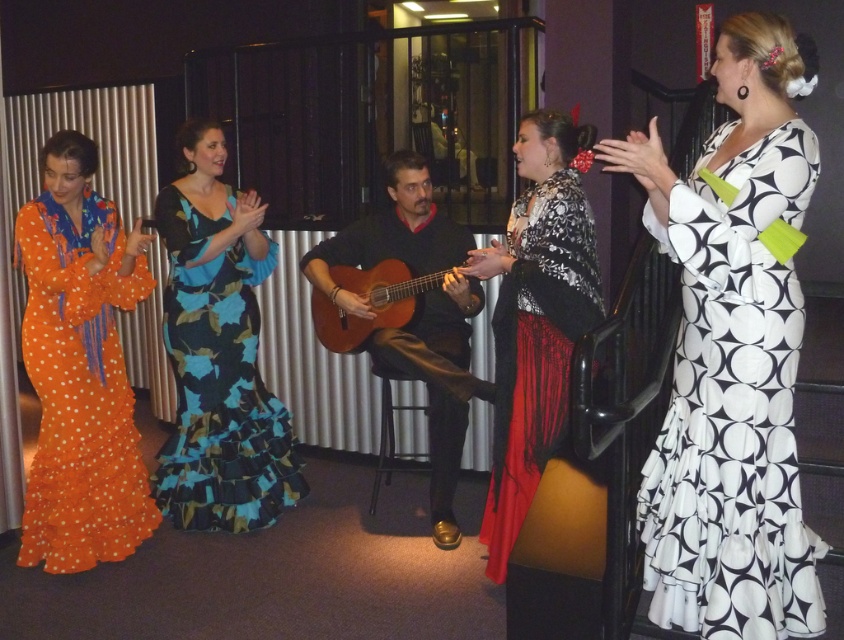
You are a photographer setting up for a flamenco performance. You have two dresses in your viewfinder, the black and white printed dress at right and the black lace dress at center. Which dress appears smaller in your photo?

The black and white printed dress at right appears smaller than the black lace dress at center in the photo.

You are a photographer at the flamenco performance. You need to capture a photo where the black and white printed dress at right and the black lace dress at center are both visible. Which dress will appear shorter in the photo?

The black and white printed dress at right is shorter than the black lace dress at center, so it will appear shorter in the photo.

You are a photographer positioned at the front of the stage. You want to capture a photo where both the matte black guitar at center and the wooden acoustic guitar at center are visible. Which guitar should you adjust your camera angle to focus on first to ensure both are in frame?

The matte black guitar at center is to the right of the wooden acoustic guitar at center. To ensure both are in frame, focus on the wooden acoustic guitar at center first since it is on the left, then adjust to include the matte black guitar at center on the right.